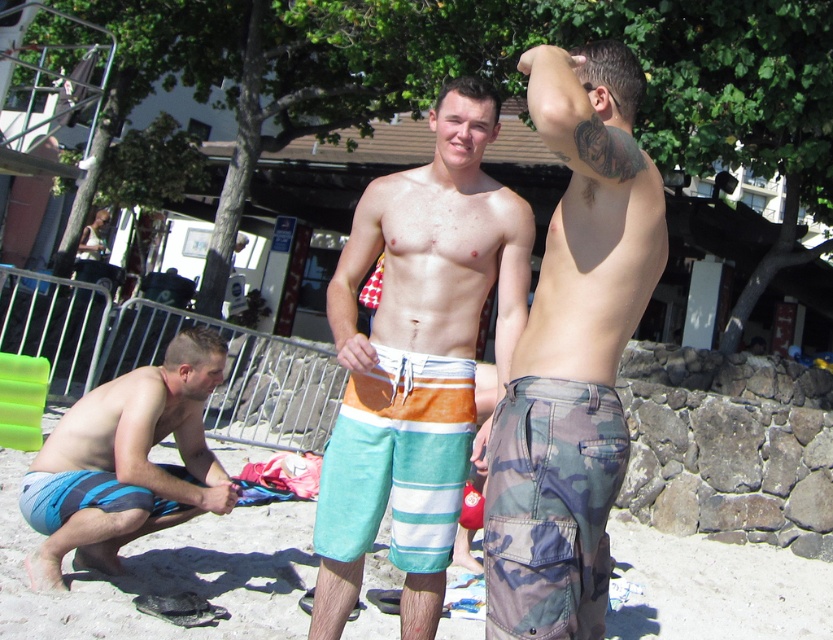
Question: Does multicolored striped boardshorts at center have a larger size compared to blue striped boardshorts at lower left?

Choices:
 (A) no
 (B) yes

Answer: (B)

Question: Which point is farther from the camera taking this photo?

Choices:
 (A) (171, 428)
 (B) (469, 301)
 (C) (536, 563)

Answer: (A)

Question: Which point is farther from the camera taking this photo?

Choices:
 (A) tap(505, 250)
 (B) tap(68, 502)
 (C) tap(580, 467)

Answer: (B)

Question: Is camo fabric shorts at right thinner than blue striped boardshorts at lower left?

Choices:
 (A) yes
 (B) no

Answer: (A)

Question: Among these objects, which one is nearest to the camera?

Choices:
 (A) camo fabric shorts at right
 (B) blue striped boardshorts at lower left
 (C) multicolored striped boardshorts at center
 (D) striped cotton boardshorts at center

Answer: (A)

Question: Does camo fabric shorts at right have a lesser width compared to striped cotton boardshorts at center?

Choices:
 (A) yes
 (B) no

Answer: (A)